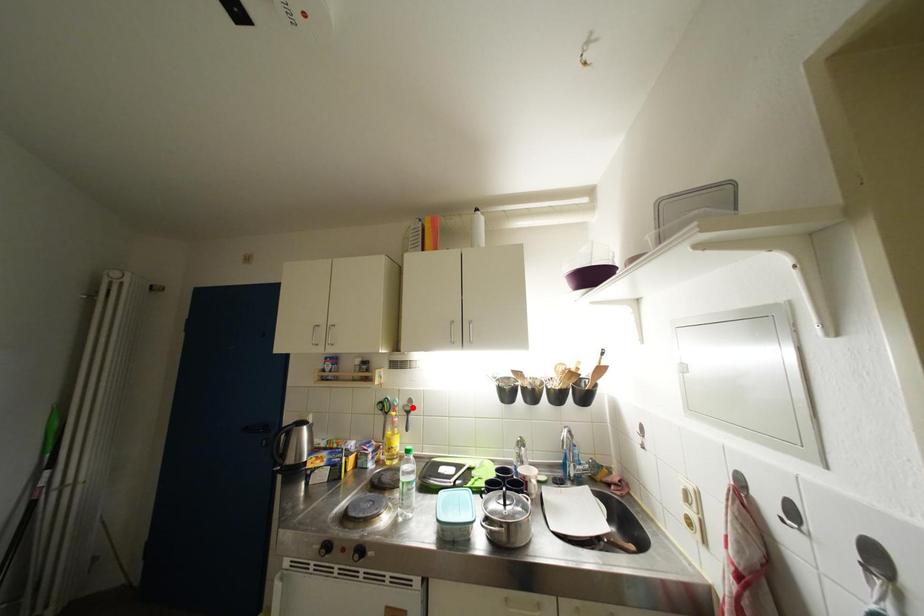
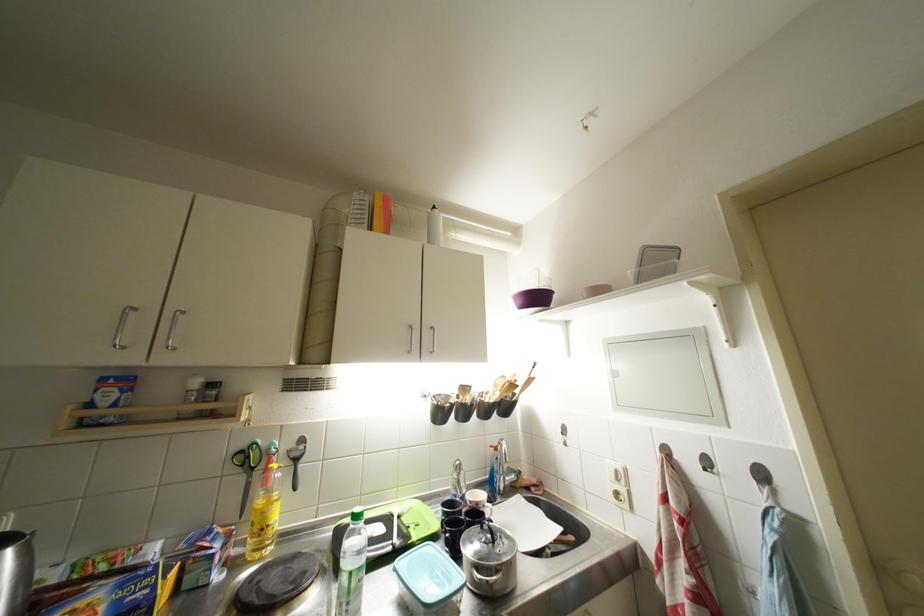
Find the pixel in the second image that matches the highlighted location in the first image.

(299, 450)